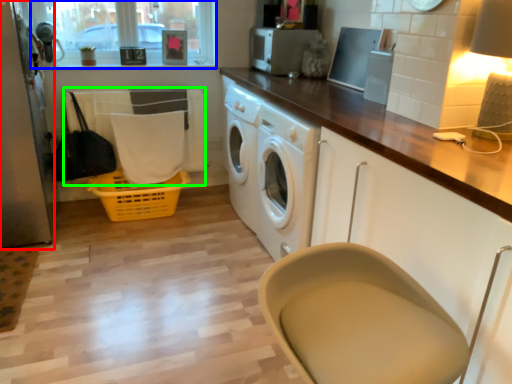
Question: Estimate the real-world distances between objects in this image. Which object is farther from screen door (highlighted by a red box), window screen (highlighted by a blue box) or laundry (highlighted by a green box)?

Choices:
 (A) window screen
 (B) laundry

Answer: (A)